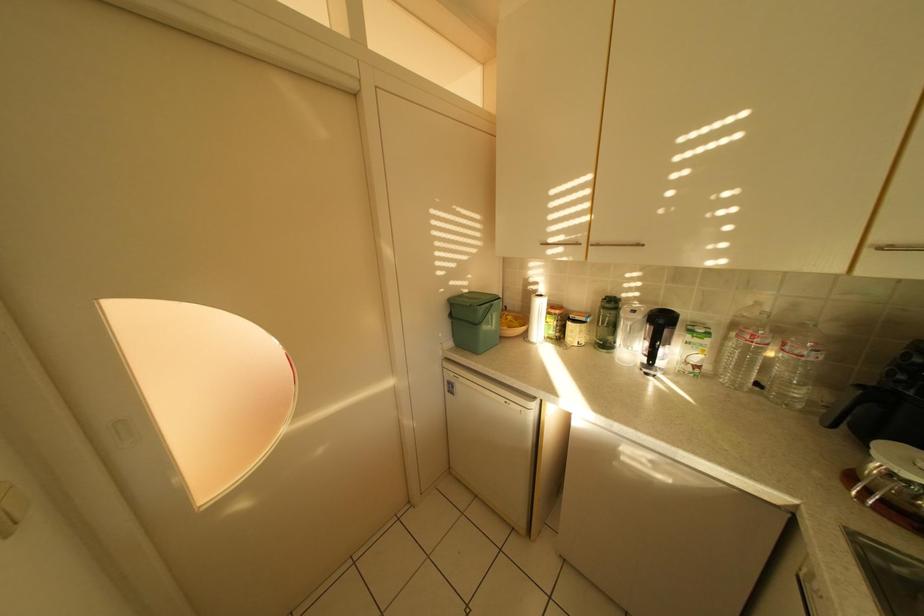
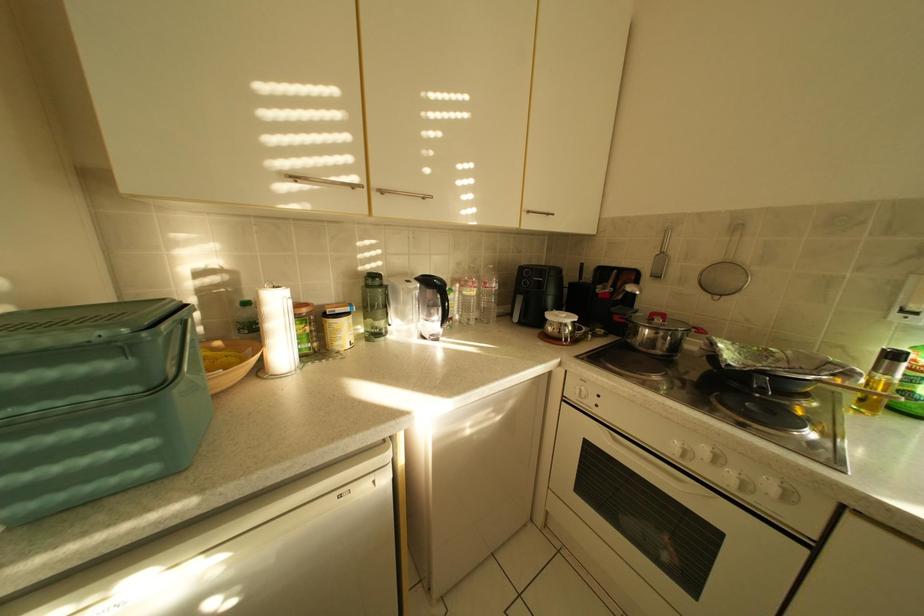
Question: The first image is from the beginning of the video and the second image is from the end. How did the camera likely rotate when shooting the video?

Choices:
 (A) Left
 (B) Right
 (C) Up
 (D) Down

Answer: (B)